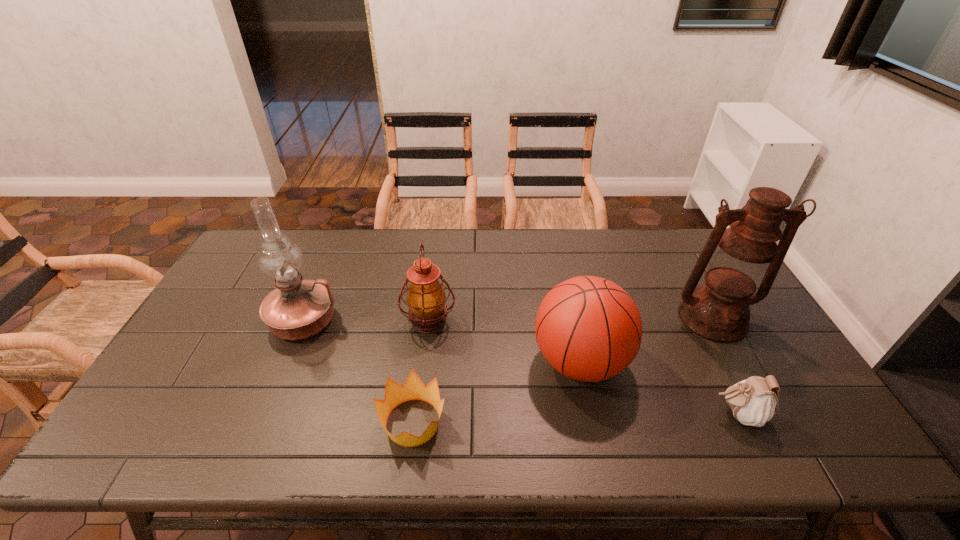
Image resolution: width=960 pixels, height=540 pixels. In order to click on free location located 0.400m on the front-facing side of the pouch in this screenshot , I will do `click(545, 415)`.

The height and width of the screenshot is (540, 960). In order to click on vacant space located on the front-facing side of the pouch in this screenshot , I will do `click(645, 415)`.

The image size is (960, 540). I want to click on vacant space situated on the front-facing side of the pouch, so pos(549,415).

Locate an element on the screen. Image resolution: width=960 pixels, height=540 pixels. vacant position located 0.100m on the right of the shortest object is located at coordinates (489, 422).

This screenshot has width=960, height=540. Identify the location of pouch that is at the near edge. (754, 401).

Locate an element on the screen. This screenshot has width=960, height=540. crown that is at the near edge is located at coordinates (413, 389).

The height and width of the screenshot is (540, 960). What are the coordinates of `oil lamp that is at the right edge` in the screenshot? It's located at (738, 260).

This screenshot has height=540, width=960. Find the location of `pouch that is at the right edge`. pouch that is at the right edge is located at coordinates (754, 401).

Find the location of a particular element. The height and width of the screenshot is (540, 960). object present at the near right corner is located at coordinates pyautogui.click(x=754, y=401).

Image resolution: width=960 pixels, height=540 pixels. In order to click on vacant position at the far edge of the desktop in this screenshot , I will do `click(347, 259)`.